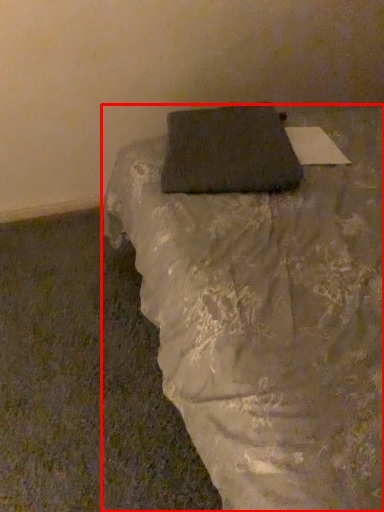
Question: From the image's perspective, considering the relative positions of furniture (annotated by the red box) and pillow in the image provided, where is furniture (annotated by the red box) located with respect to the staircase?

Choices:
 (A) below
 (B) above

Answer: (A)